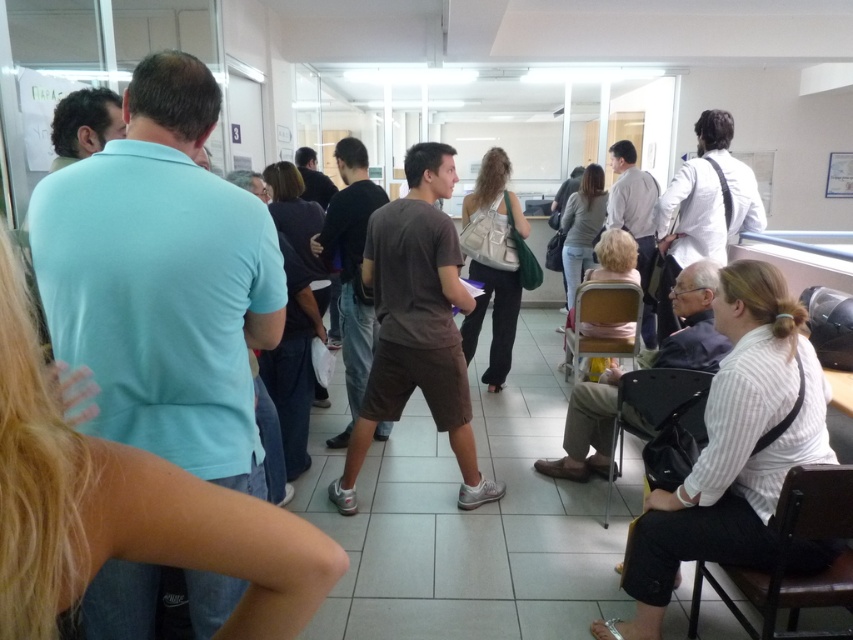
Question: Which object appears farthest from the camera in this image?

Choices:
 (A) white striped shirt at lower right
 (B) wooden chair at center

Answer: (B)

Question: Which is farther from the brown wooden chair at lower right?

Choices:
 (A) black fabric chair at lower right
 (B) brown cotton t-shirt at center
 (C) white striped shirt at lower right

Answer: (B)

Question: Which object is farther from the camera taking this photo?

Choices:
 (A) wooden chair at center
 (B) black fabric chair at lower right
 (C) brown wooden chair at lower right

Answer: (A)

Question: Does white striped shirt at lower right have a smaller size compared to brown wooden chair at lower right?

Choices:
 (A) yes
 (B) no

Answer: (B)

Question: Can you confirm if black fabric chair at lower right is positioned below wooden chair at center?

Choices:
 (A) no
 (B) yes

Answer: (B)

Question: Is brown cotton t-shirt at center to the left of brown wooden chair at lower right from the viewer's perspective?

Choices:
 (A) no
 (B) yes

Answer: (B)